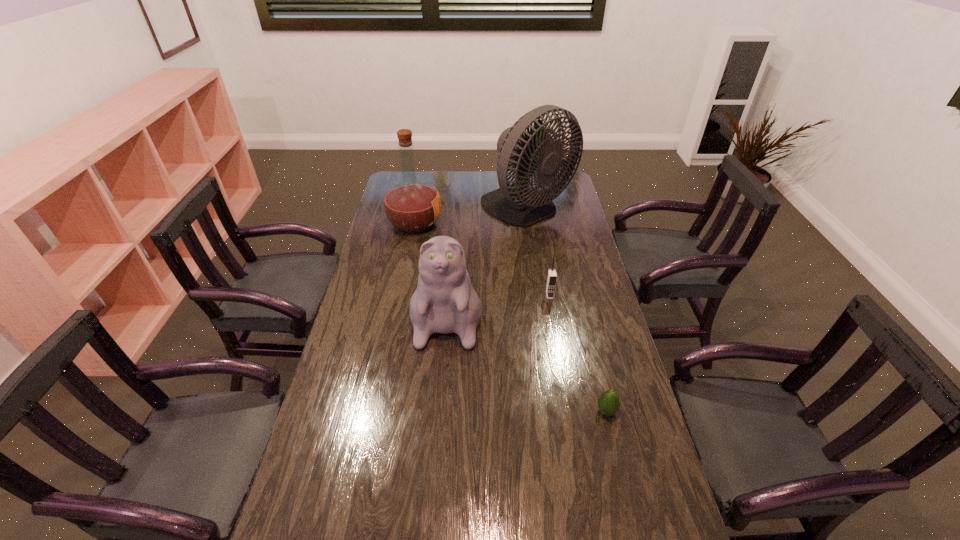
Locate an element on the screen. This screenshot has width=960, height=540. fan is located at coordinates (518, 204).

At what (x,y) coordinates should I click in order to perform the action: click on liquor. Please return your answer as a coordinate pair (x, y). Looking at the image, I should click on (412, 205).

At what (x,y) coordinates should I click in order to perform the action: click on the third shortest object. Please return your answer as a coordinate pair (x, y). Looking at the image, I should click on (444, 302).

Find the location of a particular element. the second shortest object is located at coordinates (552, 276).

Image resolution: width=960 pixels, height=540 pixels. Find the location of `the nearest object`. the nearest object is located at coordinates click(608, 402).

The height and width of the screenshot is (540, 960). I want to click on avocado, so click(x=608, y=402).

Locate an element on the screen. The height and width of the screenshot is (540, 960). vacant space located 0.150m in front of the fan to direct airflow is located at coordinates (535, 260).

Locate an element on the screen. free point located 0.270m on the front label of the fourth shortest object is located at coordinates (506, 224).

Where is `free space located 0.130m on the face of the cat`? free space located 0.130m on the face of the cat is located at coordinates (442, 387).

This screenshot has width=960, height=540. I want to click on vacant position located 0.090m on the front-facing side of the second shortest object, so click(554, 318).